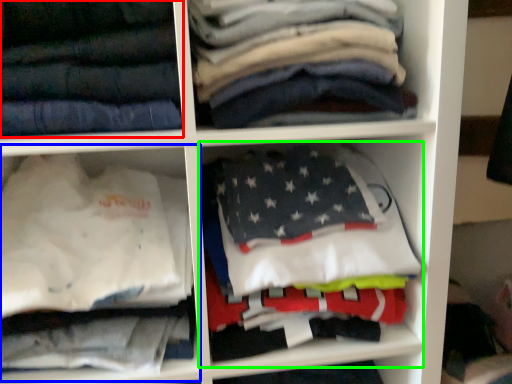
Question: Estimate the real-world distances between objects in this image. Which object is farther from trousers (highlighted by a red box), cabinet (highlighted by a blue box) or cabinet (highlighted by a green box)?

Choices:
 (A) cabinet
 (B) cabinet

Answer: (B)